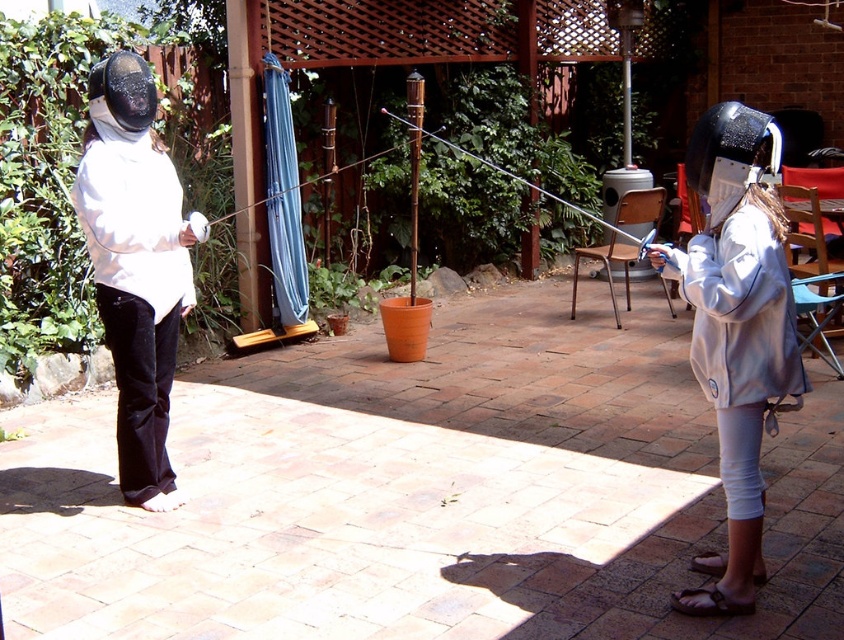
Is white matte fencing suit at right smaller than white matte jacket at left?

Incorrect, white matte fencing suit at right is not smaller in size than white matte jacket at left.

Where is `white matte fencing suit at right`? This screenshot has height=640, width=844. white matte fencing suit at right is located at coordinates (736, 330).

I want to click on white matte fencing suit at right, so click(x=736, y=330).

Does white matte jacket at left appear under light gray fleece jacket at right?

No.

Where is `white matte jacket at left`? white matte jacket at left is located at coordinates (134, 266).

Which is behind, point (109, 74) or point (721, 385)?

Point (109, 74)

The height and width of the screenshot is (640, 844). What are the coordinates of `white matte jacket at left` in the screenshot? It's located at point(134,266).

Who is shorter, white matte fencing suit at right or light gray fleece jacket at right?

Standing shorter between the two is light gray fleece jacket at right.

Image resolution: width=844 pixels, height=640 pixels. Describe the element at coordinates (736, 330) in the screenshot. I see `white matte fencing suit at right` at that location.

Locate an element on the screen. white matte fencing suit at right is located at coordinates (736, 330).

Where is `white matte fencing suit at right`? The width and height of the screenshot is (844, 640). white matte fencing suit at right is located at coordinates (736, 330).